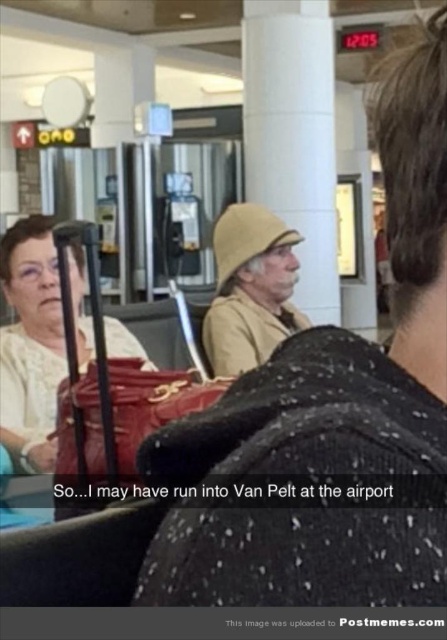
Question: Is matte black suitcase at left thinner than beige fabric hat at center?

Choices:
 (A) yes
 (B) no

Answer: (B)

Question: Which object appears closest to the camera in this image?

Choices:
 (A) matte black suitcase at left
 (B) beige fabric hat at upper center

Answer: (B)

Question: Which point is closer to the camera?

Choices:
 (A) (47, 419)
 (B) (391, 404)
 (C) (244, 266)

Answer: (B)

Question: Which is nearer to the beige fabric hat at upper center?

Choices:
 (A) matte black suitcase at left
 (B) beige fabric hat at center

Answer: (A)

Question: Does beige fabric hat at upper center have a smaller size compared to matte black suitcase at left?

Choices:
 (A) no
 (B) yes

Answer: (B)

Question: Considering the relative positions of matte black suitcase at left and beige fabric hat at center in the image provided, where is matte black suitcase at left located with respect to beige fabric hat at center?

Choices:
 (A) below
 (B) above

Answer: (A)